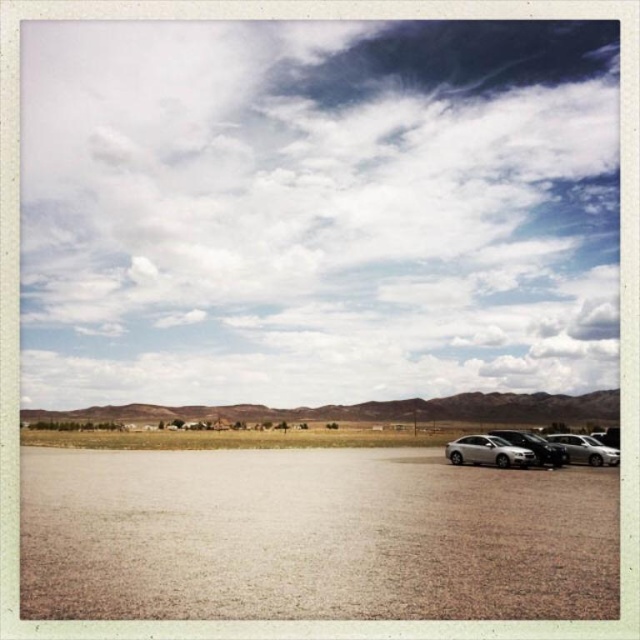
Question: Can you confirm if brown sandy dirt field at lower center is smaller than satin silver sedan at lower right?

Choices:
 (A) no
 (B) yes

Answer: (A)

Question: Can you confirm if brown sandy dirt field at lower center is wider than satin silver sedan at lower right?

Choices:
 (A) no
 (B) yes

Answer: (B)

Question: Which object is closer to the camera taking this photo?

Choices:
 (A) satin silver sedan at center
 (B) satin silver car at lower right
 (C) white fluffy cloud at upper center
 (D) brown sandy dirt field at lower center

Answer: (D)

Question: Estimate the real-world distances between objects in this image. Which object is farther from the satin silver sedan at lower right?

Choices:
 (A) satin silver sedan at center
 (B) brown sandy dirt field at lower center
 (C) satin silver car at lower right
 (D) white fluffy cloud at upper center

Answer: (D)

Question: In this image, where is white fluffy cloud at upper center located relative to satin silver sedan at center?

Choices:
 (A) right
 (B) left

Answer: (B)

Question: Which point is farther to the camera?

Choices:
 (A) (566, 454)
 (B) (428, 51)

Answer: (B)